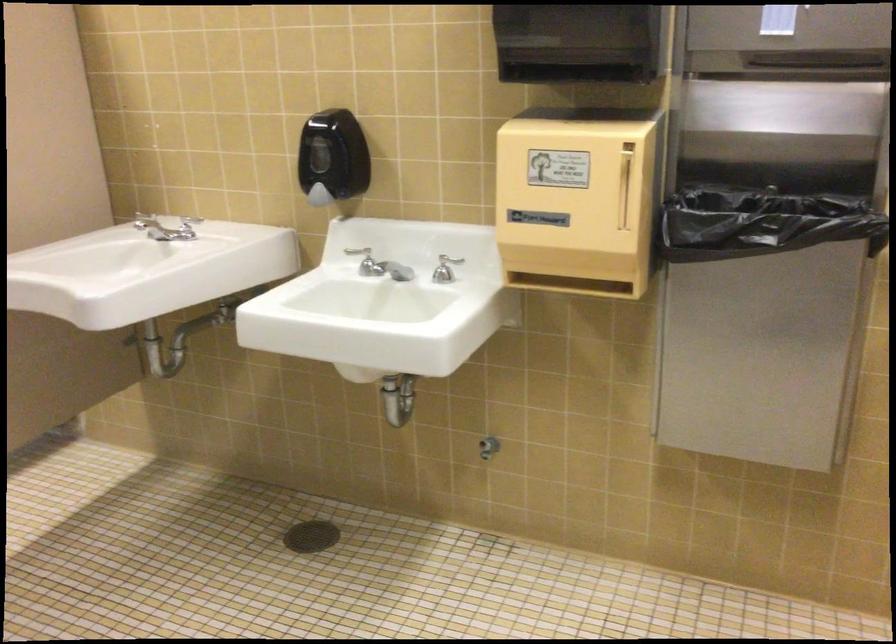
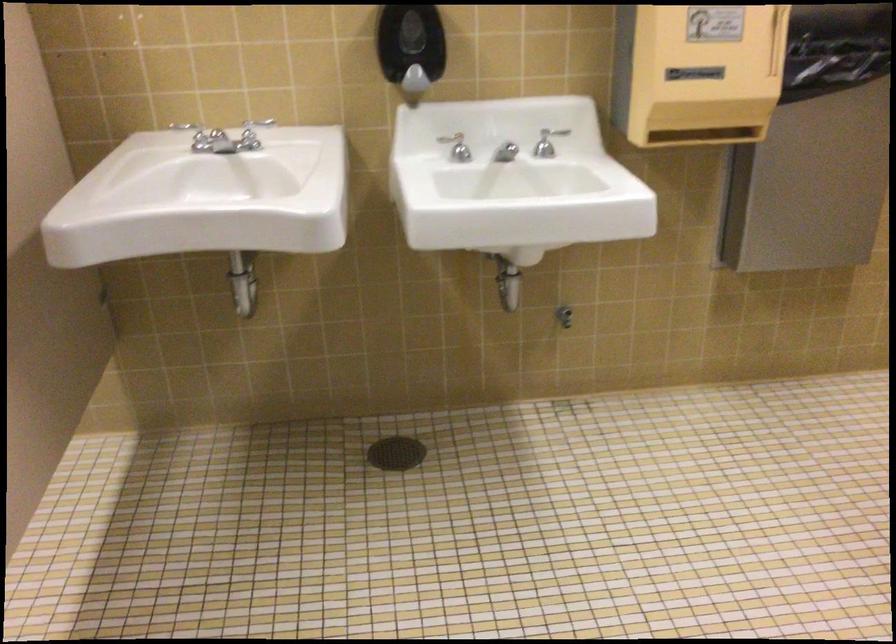
The point at (314,204) is marked in the first image. Where is the corresponding point in the second image?

(412, 84)